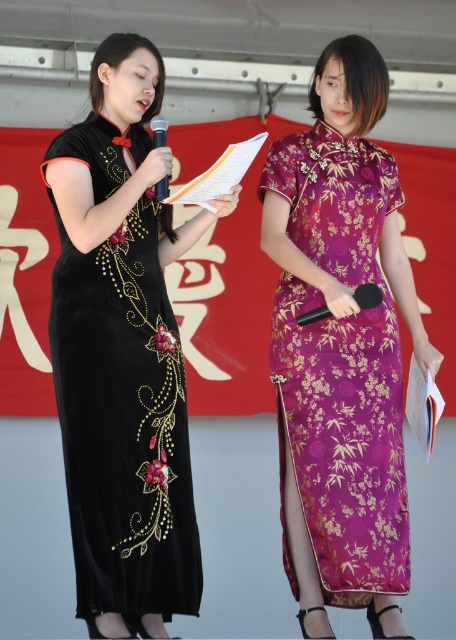
Question: Which point is farther to the camera?

Choices:
 (A) velvet black dress at left
 (B) black matte microphone at center

Answer: (B)

Question: Can you confirm if black matte microphone at center is positioned to the left of matte black microphone at center?

Choices:
 (A) no
 (B) yes

Answer: (A)

Question: Which is nearer to the velvet black dress at left?

Choices:
 (A) matte black microphone at center
 (B) purple silk dress at right

Answer: (B)

Question: Is velvet black dress at left to the left of purple silk dress at right from the viewer's perspective?

Choices:
 (A) no
 (B) yes

Answer: (B)

Question: Is velvet black dress at left positioned in front of black matte microphone at center?

Choices:
 (A) yes
 (B) no

Answer: (A)

Question: Considering the real-world distances, which object is farthest from the matte black microphone at center?

Choices:
 (A) velvet black dress at left
 (B) purple silk dress at right
 (C) black matte microphone at center

Answer: (B)